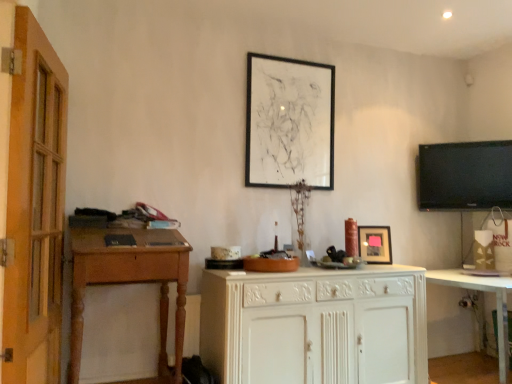
Question: Does black matte picture frame at upper center, which is the 2th picture frame from bottom to top, have a lesser width compared to white glossy cabinet at lower right?

Choices:
 (A) no
 (B) yes

Answer: (B)

Question: Is black matte picture frame at upper center, placed as the first picture frame when sorted from top to bottom, outside white glossy cabinet at lower right?

Choices:
 (A) yes
 (B) no

Answer: (A)

Question: Is black matte picture frame at upper center, which is the 2th picture frame from bottom to top, oriented away from white glossy cabinet at lower right?

Choices:
 (A) yes
 (B) no

Answer: (B)

Question: Is black matte picture frame at upper center, which is the 2th picture frame from bottom to top, aimed at white glossy cabinet at lower right?

Choices:
 (A) no
 (B) yes

Answer: (A)

Question: From the image's perspective, is black matte picture frame at upper center, placed as the first picture frame when sorted from top to bottom, above white glossy cabinet at lower right?

Choices:
 (A) no
 (B) yes

Answer: (B)

Question: From a real-world perspective, is black matte picture frame at upper center, which is the 2th picture frame from bottom to top, positioned over white glossy cabinet at lower right based on gravity?

Choices:
 (A) no
 (B) yes

Answer: (B)

Question: From the image's perspective, is wooden desk at left over white painted wood cabinet at center?

Choices:
 (A) no
 (B) yes

Answer: (B)

Question: Is wooden desk at left placed right next to white painted wood cabinet at center?

Choices:
 (A) yes
 (B) no

Answer: (B)

Question: Is the position of wooden desk at left more distant than that of white painted wood cabinet at center?

Choices:
 (A) no
 (B) yes

Answer: (A)

Question: Is wooden desk at left wider than white painted wood cabinet at center?

Choices:
 (A) no
 (B) yes

Answer: (A)

Question: Is wooden desk at left outside white painted wood cabinet at center?

Choices:
 (A) yes
 (B) no

Answer: (A)

Question: Could you tell me if wooden desk at left is turned towards white painted wood cabinet at center?

Choices:
 (A) no
 (B) yes

Answer: (A)

Question: From a real-world perspective, is white glossy cabinet at lower right physically below white painted wood cabinet at center?

Choices:
 (A) yes
 (B) no

Answer: (A)